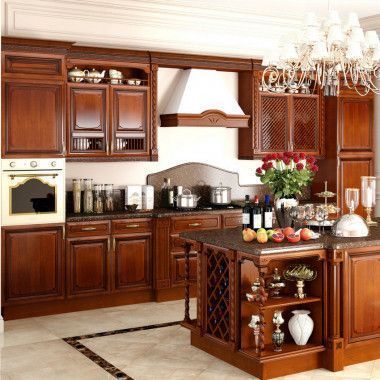
Find the location of `tile`. tile is located at coordinates (33, 360).